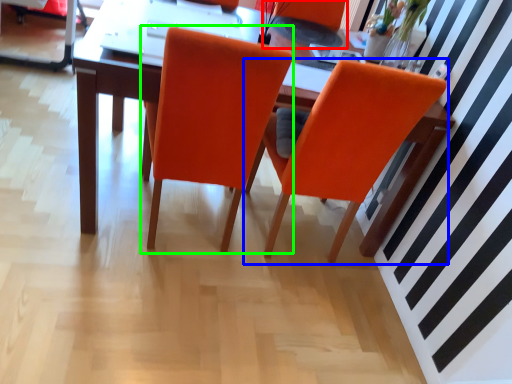
Question: Which object is positioned closest to armchair (highlighted by a red box)? Select from chair (highlighted by a blue box) and chair (highlighted by a green box).

Choices:
 (A) chair
 (B) chair

Answer: (A)